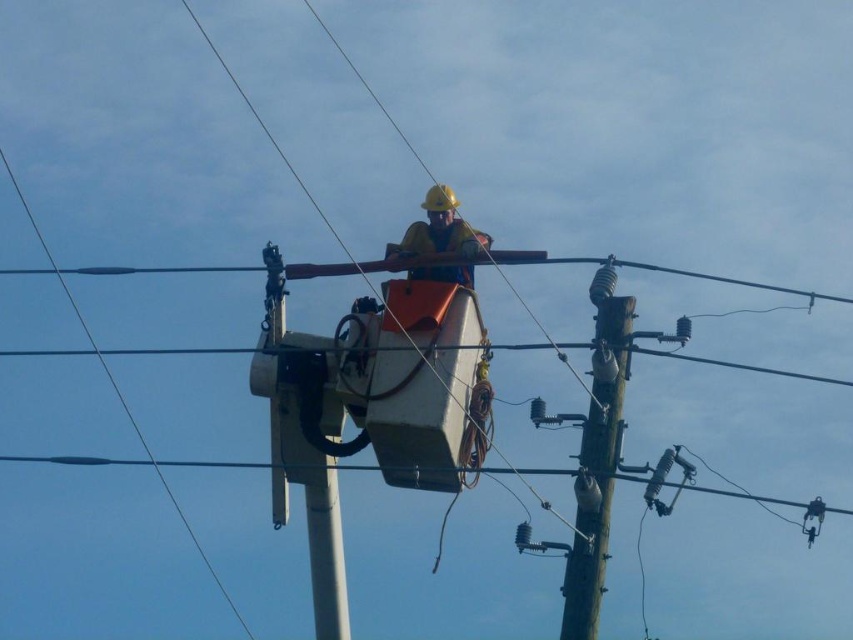
You are a safety inspector checking the equipment in the image. The wooden telegraph pole at center and the yellow hard hat at center are both visible. Which object has a greater width?

The wooden telegraph pole at center has a greater width than the yellow hard hat at center.

You are a safety inspector assessing the utility worker in the scene. You notice the wooden telegraph pole at center and the yellow hard hat at center. Which object is taller?

The wooden telegraph pole at center is taller than the yellow hard hat at center.